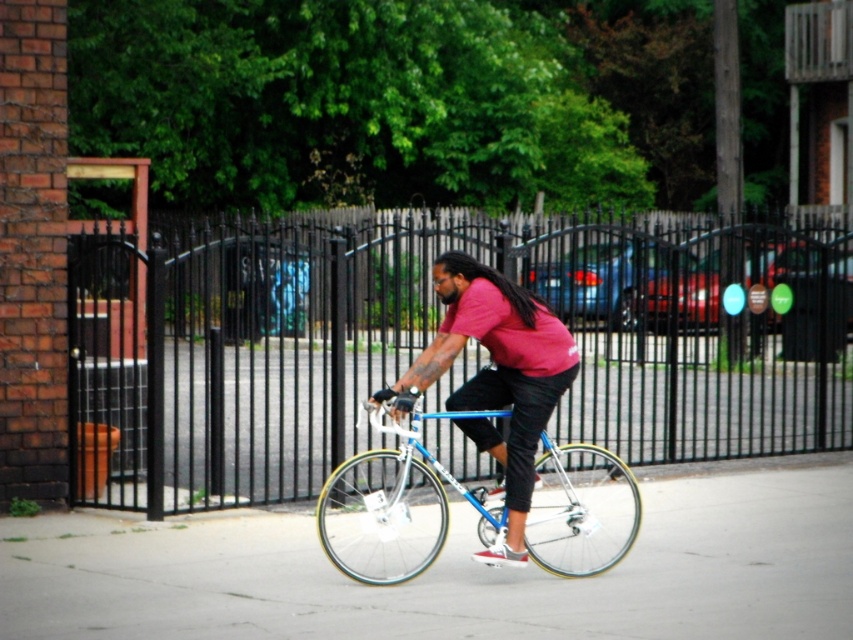
Question: In this image, where is black metal fence at center located relative to gray concrete pavement at center?

Choices:
 (A) left
 (B) right

Answer: (B)

Question: Which point is farther to the camera?

Choices:
 (A) (167, 625)
 (B) (461, 308)
 (C) (389, 330)
 (D) (552, 552)

Answer: (C)

Question: Which point is closer to the camera?

Choices:
 (A) (480, 336)
 (B) (149, 524)

Answer: (A)

Question: Is black metal fence at center positioned behind matte blue bicycle at center?

Choices:
 (A) yes
 (B) no

Answer: (A)

Question: Can you confirm if gray concrete pavement at center is bigger than matte blue bicycle at center?

Choices:
 (A) yes
 (B) no

Answer: (B)

Question: Which is farther from the blue metallic bicycle at center?

Choices:
 (A) matte blue bicycle at center
 (B) black metal fence at center
 (C) gray concrete pavement at center

Answer: (B)